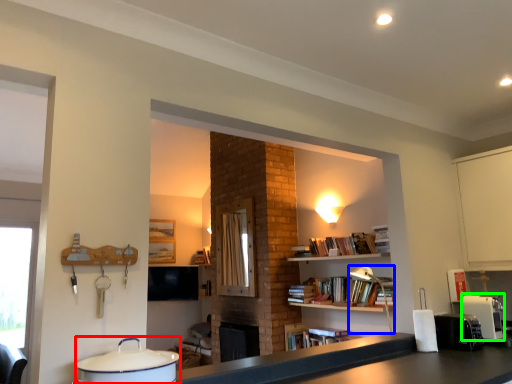
Question: Which is nearer to the appliance (highlighted by a red box)? lamp (highlighted by a blue box) or coffee machine (highlighted by a green box).

Choices:
 (A) lamp
 (B) coffee machine

Answer: (B)